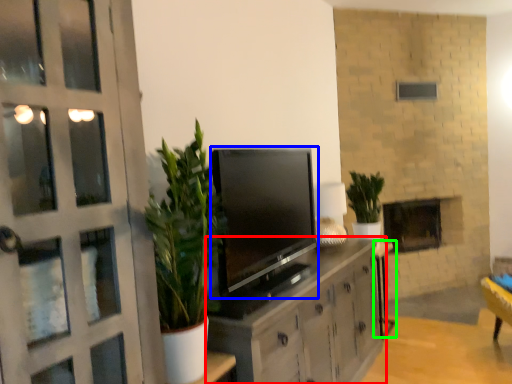
Question: Estimate the real-world distances between objects in this image. Which object is farther from cabinetry (highlighted by a red box), television (highlighted by a blue box) or table (highlighted by a green box)?

Choices:
 (A) television
 (B) table

Answer: (B)